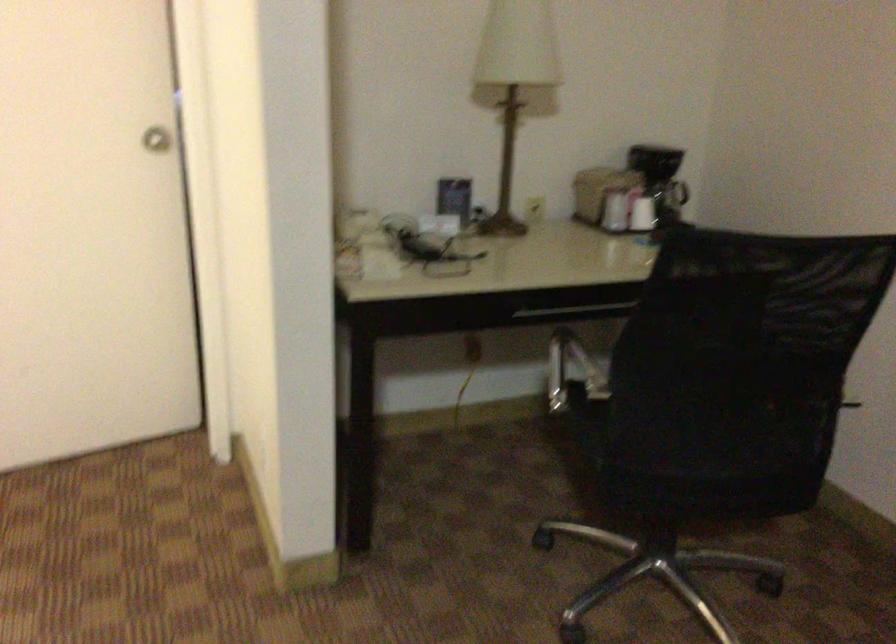
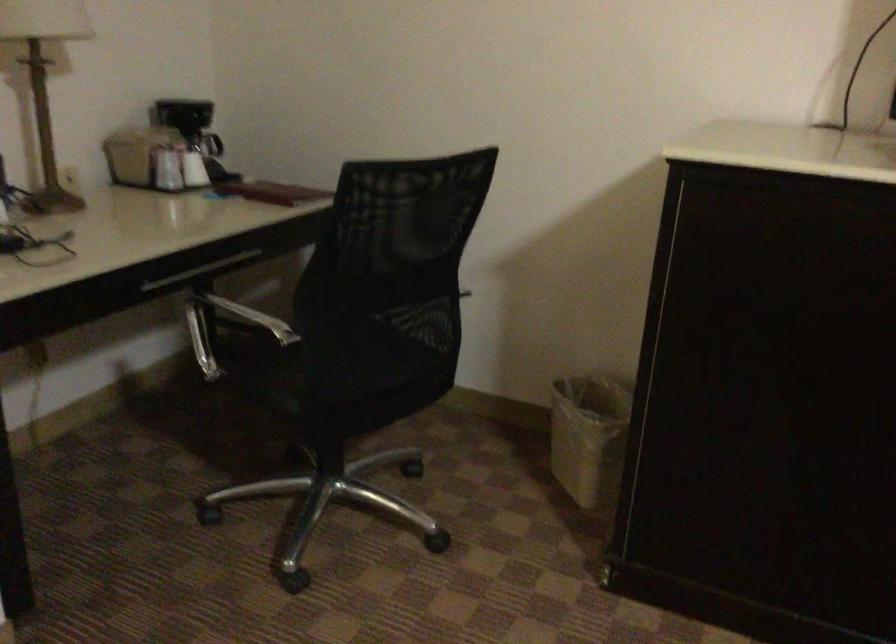
Where in the second image is the point corresponding to [635,214] from the first image?

(194, 169)